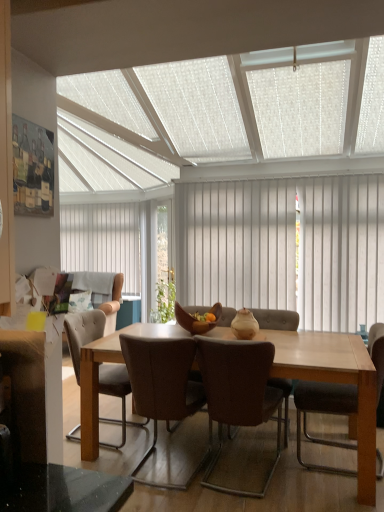
Question: Could you tell me if brown leather chair at center, which is counted as the 2th chair, starting from the right, is turned towards white vertical blinds at center, positioned as the 2th curtain in front-to-back order?

Choices:
 (A) no
 (B) yes

Answer: (A)

Question: Does brown leather chair at center, which is counted as the 2th chair, starting from the right, appear on the left side of white vertical blinds at center, the first curtain viewed from the left?

Choices:
 (A) yes
 (B) no

Answer: (B)

Question: From a real-world perspective, is brown leather chair at center, which is counted as the 2th chair, starting from the right, beneath white vertical blinds at center, positioned as the 2th curtain in front-to-back order?

Choices:
 (A) no
 (B) yes

Answer: (B)

Question: Is brown leather chair at center, which ranks as the 2th chair in left-to-right order, surrounding white vertical blinds at center, positioned as the 2th curtain in front-to-back order?

Choices:
 (A) no
 (B) yes

Answer: (A)

Question: Is brown leather chair at center, which is counted as the 2th chair, starting from the right, smaller than white vertical blinds at center, the 2th curtain when ordered from right to left?

Choices:
 (A) no
 (B) yes

Answer: (A)

Question: Can you confirm if brown leather chair at center, which is counted as the 2th chair, starting from the right, is wider than white vertical blinds at center, which appears as the 1th curtain when viewed from the back?

Choices:
 (A) yes
 (B) no

Answer: (A)

Question: Is brown leather chair at center, which is counted as the 2th chair, starting from the right, further to camera compared to brown leather chair at right, which is the 1th chair from right to left?

Choices:
 (A) yes
 (B) no

Answer: (B)

Question: From a real-world perspective, is brown leather chair at center, which is counted as the 2th chair, starting from the right, on brown leather chair at right, the 3th chair viewed from the left?

Choices:
 (A) yes
 (B) no

Answer: (B)

Question: Can you confirm if brown leather chair at center, which is counted as the 2th chair, starting from the right, is shorter than brown leather chair at right, which is the 1th chair from right to left?

Choices:
 (A) no
 (B) yes

Answer: (A)

Question: Is brown leather chair at center, which is counted as the 2th chair, starting from the right, facing away from brown leather chair at right, the 3th chair viewed from the left?

Choices:
 (A) yes
 (B) no

Answer: (B)

Question: Does brown leather chair at center, which is counted as the 2th chair, starting from the right, have a smaller size compared to brown leather chair at right, which is the 1th chair from right to left?

Choices:
 (A) no
 (B) yes

Answer: (B)

Question: Can you confirm if brown leather chair at center, which is counted as the 2th chair, starting from the right, is bigger than brown leather chair at right, which is the 1th chair from right to left?

Choices:
 (A) yes
 (B) no

Answer: (B)

Question: Does white vertical blinds at center, the first curtain viewed from the right, have a lesser width compared to white textured ceiling at upper center?

Choices:
 (A) no
 (B) yes

Answer: (B)